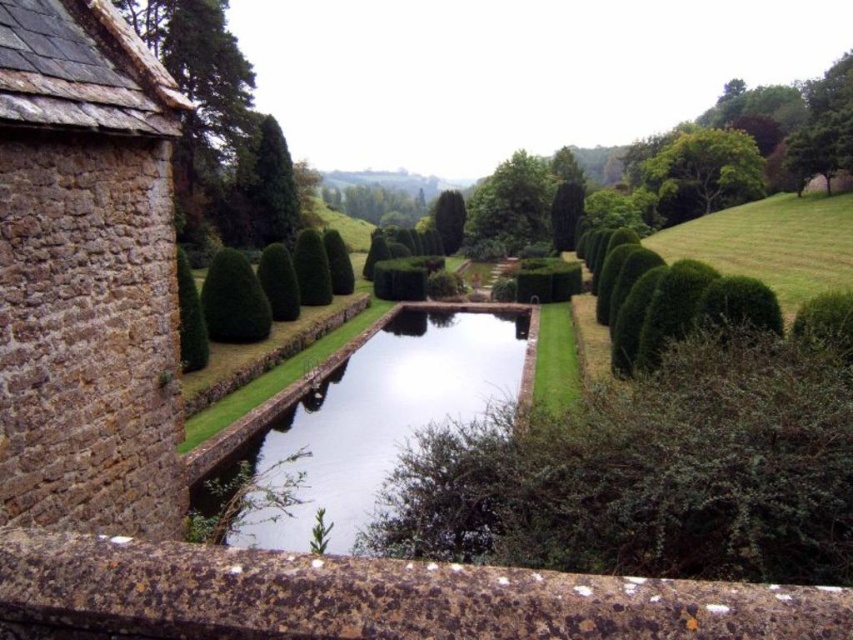
Which of these two, clear water at center or green leafy tree at upper right, stands shorter?

Standing shorter between the two is clear water at center.

Can you confirm if clear water at center is positioned to the left of green leafy tree at upper right?

Indeed, clear water at center is positioned on the left side of green leafy tree at upper right.

Is point (343, 372) positioned after point (708, 161)?

No, it is not.

Locate an element on the screen. clear water at center is located at coordinates (374, 413).

This screenshot has width=853, height=640. I want to click on clear water at center, so click(374, 413).

Does clear water at center appear on the right side of green textured hedge at center?

Indeed, clear water at center is positioned on the right side of green textured hedge at center.

Where is `clear water at center`? clear water at center is located at coordinates (374, 413).

Is green leafy bush at center shorter than green textured hedge at center?

Indeed, green leafy bush at center has a lesser height compared to green textured hedge at center.

Which is in front, point (234, 298) or point (183, 339)?

Point (183, 339)

Which is behind, point (248, 291) or point (189, 332)?

Point (248, 291)

Where is `green leafy bush at center`? This screenshot has width=853, height=640. green leafy bush at center is located at coordinates click(x=233, y=300).